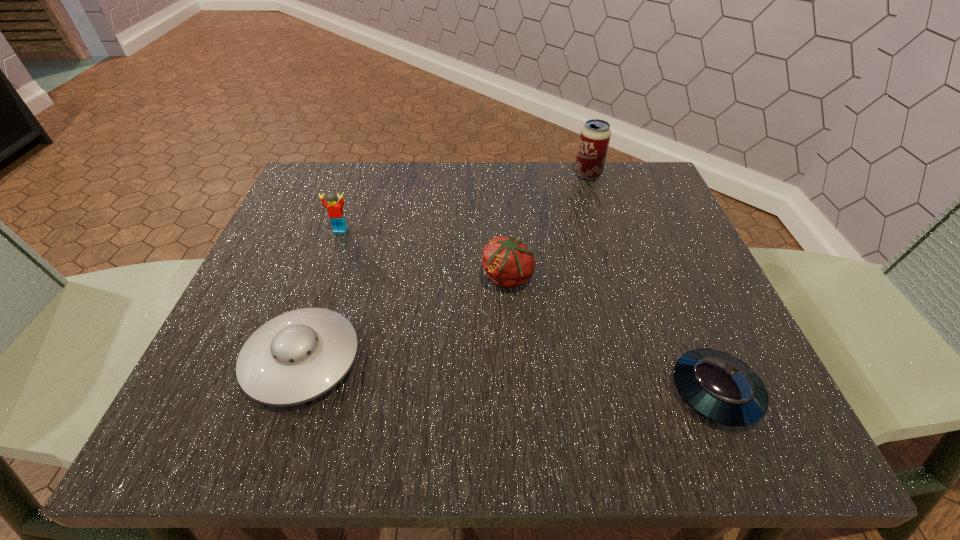
The width and height of the screenshot is (960, 540). Identify the location of object present at the far right corner. (595, 136).

Where is `object situated at the near right corner`? This screenshot has width=960, height=540. object situated at the near right corner is located at coordinates (722, 388).

Where is `free space at the far edge of the desktop`? Image resolution: width=960 pixels, height=540 pixels. free space at the far edge of the desktop is located at coordinates (538, 219).

Where is `free space at the near edge of the desktop`? The width and height of the screenshot is (960, 540). free space at the near edge of the desktop is located at coordinates (500, 446).

Locate an element on the screen. vacant space at the left edge is located at coordinates (266, 267).

I want to click on vacant area at the right edge of the desktop, so click(x=674, y=382).

Identify the location of free space at the far left corner of the desktop. (341, 177).

Locate an element on the screen. The height and width of the screenshot is (540, 960). free space at the far right corner of the desktop is located at coordinates (635, 211).

Image resolution: width=960 pixels, height=540 pixels. In order to click on vacant space at the near right corner in this screenshot , I will do pos(703,448).

At what (x,y) coordinates should I click in order to perform the action: click on vacant space in between the shorter saucer and the third object from left to right. Please return your answer as a coordinate pair (x, y). This screenshot has height=540, width=960. Looking at the image, I should click on (612, 335).